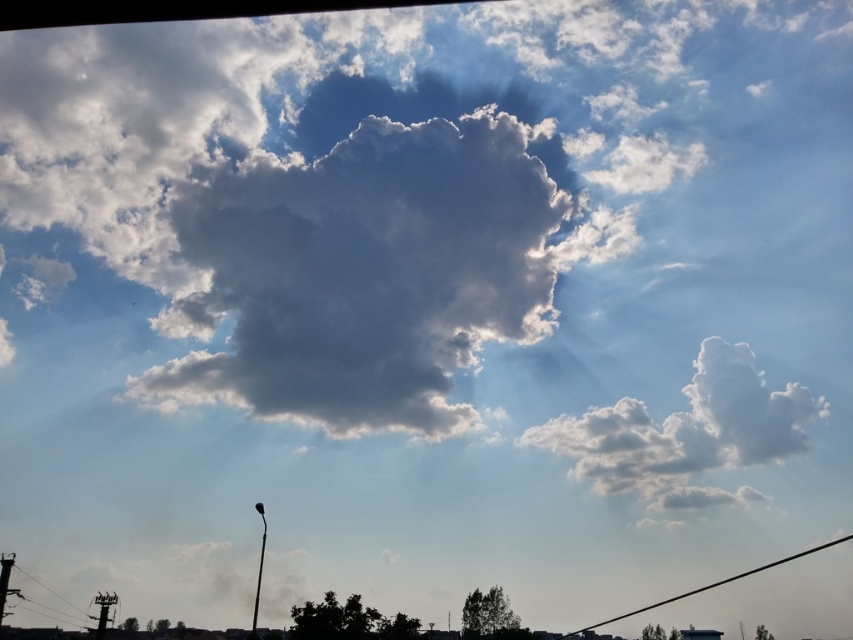
You are an airplane pilot preparing to navigate through the sky scene shown. You notice the white fluffy cloud at right and the black wire at lower right. Which object would block your path more if you were to fly directly towards them?

The white fluffy cloud at right would block your path more than the black wire at lower right because it is larger in size.

You are a bird soaring in the sky and you see the white fluffy cloud at right and the black wire at lower left. Which object is taller?

The white fluffy cloud at right is much taller than the black wire at lower left.

You are an engineer inspecting a power grid from a helicopter. You notice a white fluffy cloud at right and a black wire at lower left. Which object is located above the other in this sky scene?

The white fluffy cloud at right is positioned over the black wire at lower left, meaning it is above the wire.